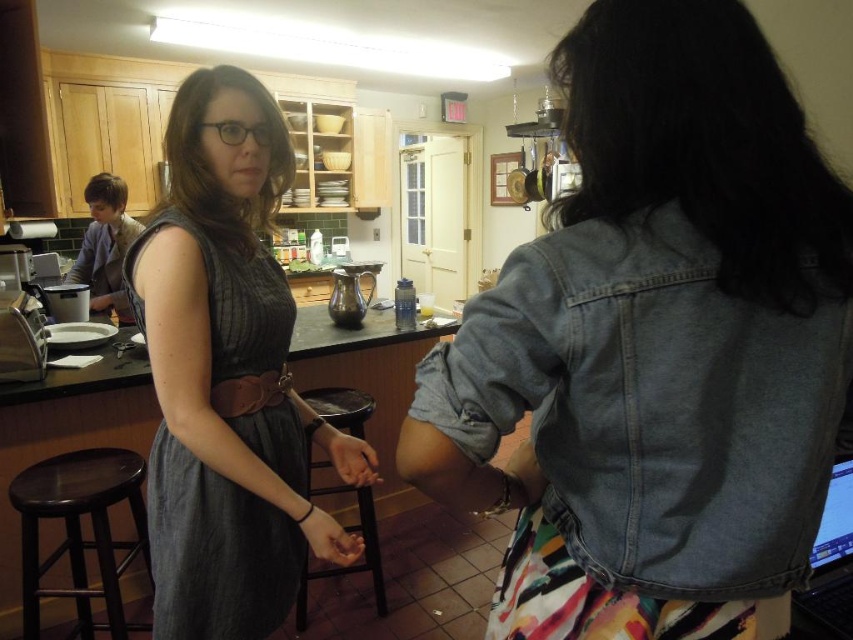
Question: Does brown leather belt at center have a smaller size compared to matte skin hand at center?

Choices:
 (A) no
 (B) yes

Answer: (B)

Question: Which is nearer to the gray linen dress at center?

Choices:
 (A) smooth skin hand at center
 (B) black wood stool at center

Answer: (A)

Question: Does black wood stool at center have a lesser width compared to matte skin hand at center?

Choices:
 (A) no
 (B) yes

Answer: (A)

Question: Which object is closer to the camera taking this photo?

Choices:
 (A) gray linen dress at center
 (B) dark brown wood stool at lower left
 (C) black glossy laptop at lower right
 (D) brown leather belt at center

Answer: (C)

Question: Which point is closer to the camera?

Choices:
 (A) gray linen dress at center
 (B) dark brown wood stool at lower left
 (C) black glossy laptop at lower right
 (D) matte skin hand at center

Answer: (C)

Question: Is dark brown wood stool at lower left positioned before matte skin hand at center?

Choices:
 (A) no
 (B) yes

Answer: (A)